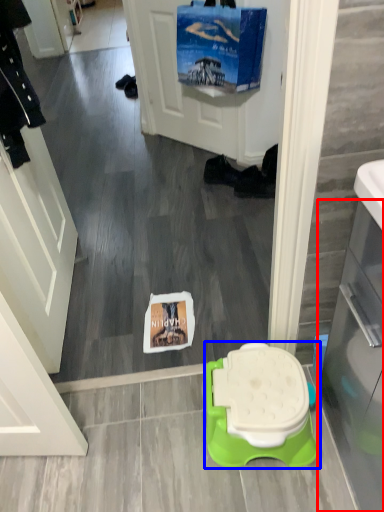
Question: Which object is closer to the camera taking this photo, glass door (highlighted by a red box) or toilet (highlighted by a blue box)?

Choices:
 (A) glass door
 (B) toilet

Answer: (A)